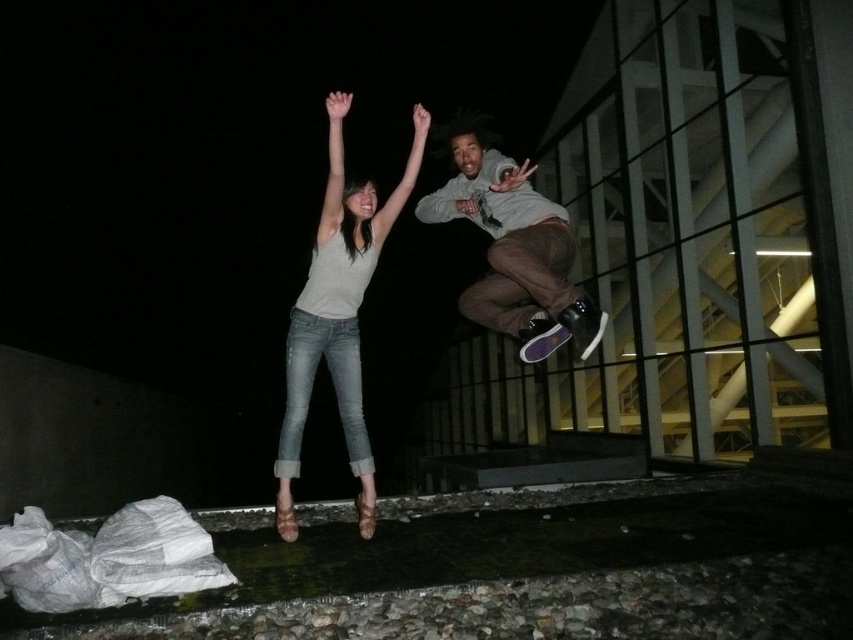
You are a photographer trying to capture the perfect shot of the denim jeans at center and the matte gray hoodie at center. From which side of the scene should you position yourself to have both subjects fully visible in the frame?

You should position yourself to the right side of the scene so that both the denim jeans at center and the matte gray hoodie at center are fully visible in the frame, as the denim jeans at center is to the left of the matte gray hoodie at center.

You are an architect designing a safety barrier for this rooftop scene. You need to determine which of the two points, point (286, 518) or point (448, 193), is closer to the edge of the rooftop. Based on the given coordinates and the spatial relationship between them, which point is closer to the edge?

Point (286, 518) is closer to the viewer than point (448, 193). Since the edge of the rooftop would be farther away from the viewer, point (448, 193) is closer to the edge.

You are a photographer trying to capture a clear shot of the matte gray shirt at center and the denim jeans at center. Since the subjects are moving, you need to focus on the one closer to the camera first. Which one should you focus on first?

The matte gray shirt at center is in front of the denim jeans at center, so you should focus on the matte gray shirt at center first to ensure it is sharp in the photo.